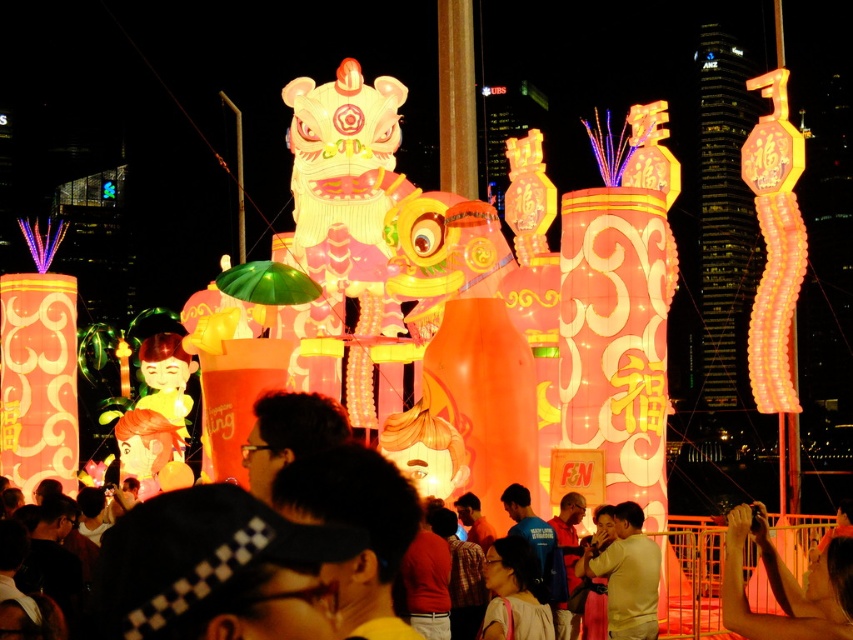
Question: Can you confirm if smooth skin arm at center is bigger than matte pink dress at center?

Choices:
 (A) yes
 (B) no

Answer: (A)

Question: Can you confirm if smooth skin arm at center is positioned to the right of matte pink dress at center?

Choices:
 (A) no
 (B) yes

Answer: (B)

Question: Does smooth skin arm at center appear on the right side of matte pink dress at center?

Choices:
 (A) yes
 (B) no

Answer: (A)